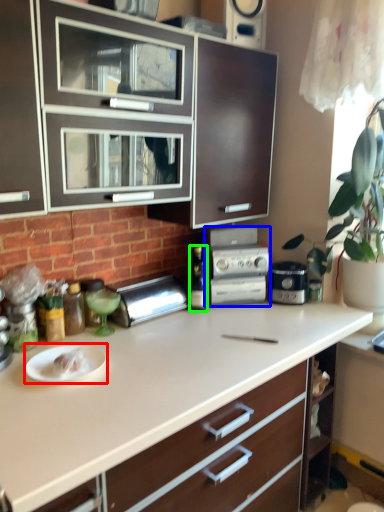
Question: Based on their relative distances, which object is farther from paper plate (highlighted by a red box)? Choose from kitchen appliance (highlighted by a blue box) and bottle (highlighted by a green box).

Choices:
 (A) kitchen appliance
 (B) bottle

Answer: (A)